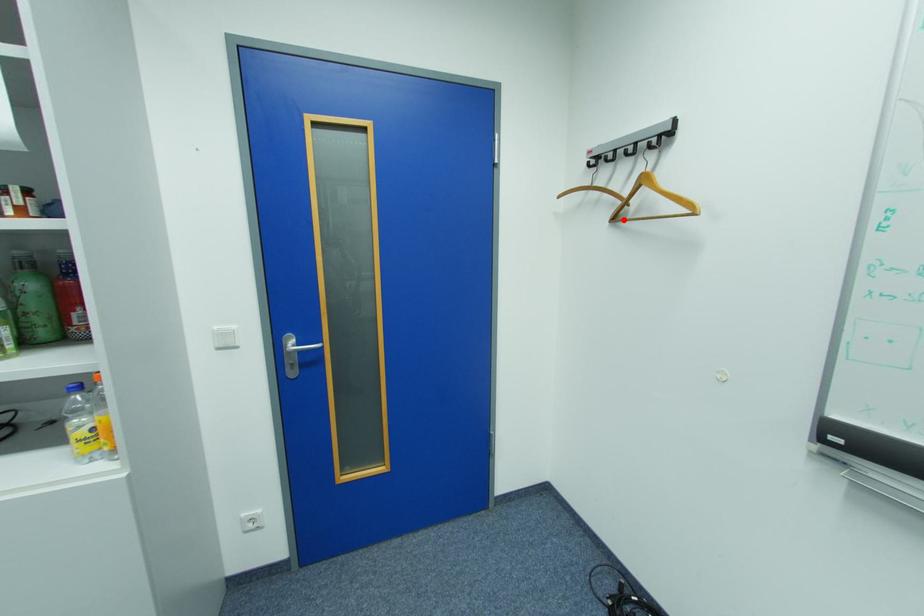
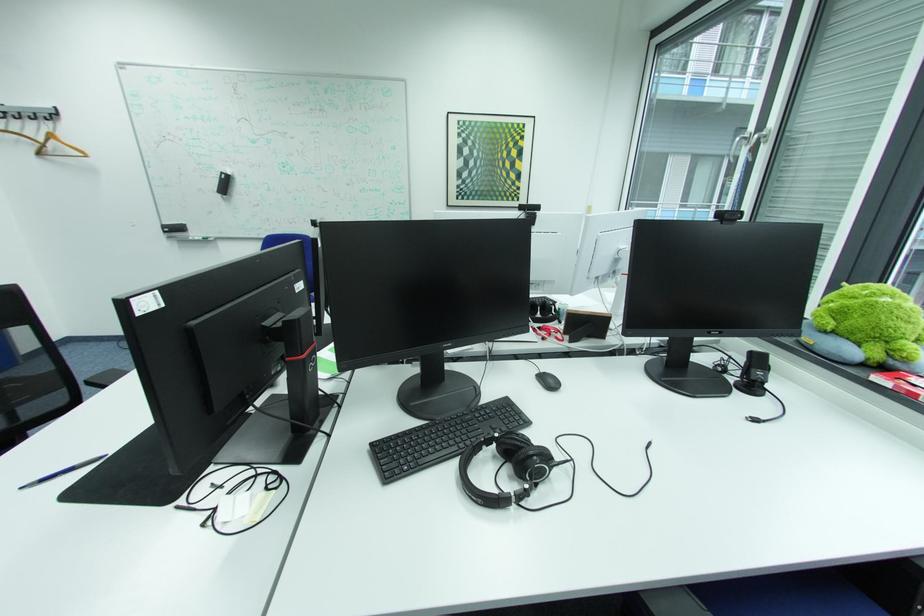
The point at the highlighted location is marked in the first image. Where is the corresponding point in the second image?

(49, 153)